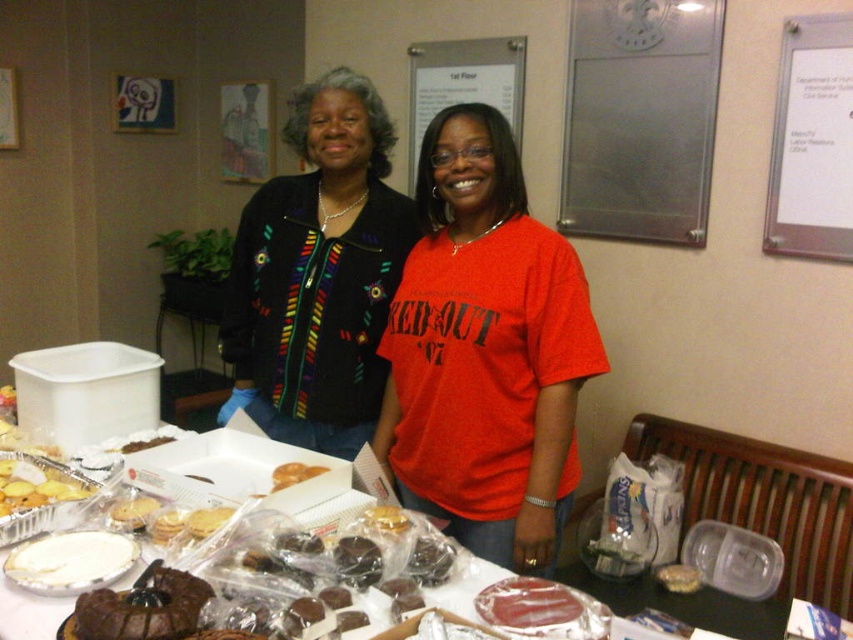
Question: Does matte black jacket at center have a lesser width compared to white paper at upper right?

Choices:
 (A) yes
 (B) no

Answer: (B)

Question: Is multicolored embroidered sweater at center bigger than white paper at upper right?

Choices:
 (A) no
 (B) yes

Answer: (B)

Question: Which object is positioned closest to the matte black jacket at center?

Choices:
 (A) white paper at upper right
 (B) golden brown foil tray at lower left
 (C) clear plastic table at center

Answer: (B)

Question: Which is nearer to the golden brown foil tray at lower left?

Choices:
 (A) multicolored embroidered sweater at center
 (B) matte black jacket at center
 (C) clear plastic table at center

Answer: (A)

Question: Can you confirm if multicolored embroidered sweater at center is thinner than white paper at upper right?

Choices:
 (A) yes
 (B) no

Answer: (B)

Question: Which of these objects is positioned farthest from the multicolored embroidered sweater at center?

Choices:
 (A) clear plastic table at center
 (B) matte black jacket at center
 (C) white paper at upper right

Answer: (C)